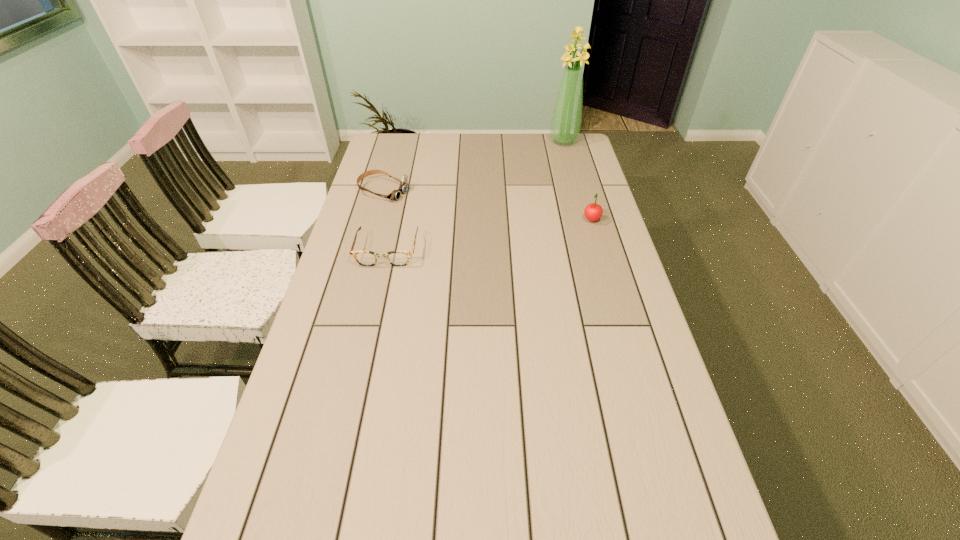
The width and height of the screenshot is (960, 540). I want to click on vacant space on the desktop that is between the spectacles and the second tallest object and is positioned on the front-facing side of the goggles, so click(522, 231).

At what (x,y) coordinates should I click in order to perform the action: click on vacant space on the desktop that is between the spectacles and the third farthest object and is positioned on the front-facing side of the farthest object. Please return your answer as a coordinate pair (x, y). This screenshot has width=960, height=540. Looking at the image, I should click on (523, 231).